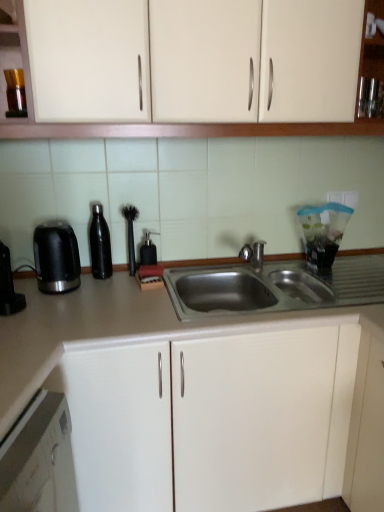
Question: From a real-world perspective, is black plastic kettle at left physically located above or below matte gray countertop at center?

Choices:
 (A) above
 (B) below

Answer: (A)

Question: In the image, is black plastic kettle at left on the left side or the right side of matte gray countertop at center?

Choices:
 (A) left
 (B) right

Answer: (A)

Question: Which object is positioned closest to the black plastic kettle at left?

Choices:
 (A) black rubber brush at center, arranged as the second appliance when viewed from the right
 (B) black plastic coffee machine at left
 (C) matte white cabinets at upper center
 (D) black matte water bottle at left, which is counted as the first appliance, starting from the left
 (E) clear plastic blender at right, the 3th appliance from the left

Answer: (B)

Question: Estimate the real-world distances between objects in this image. Which object is farther from the black plastic kettle at left?

Choices:
 (A) black rubber brush at center, arranged as the second appliance when viewed from the right
 (B) matte white cabinets at upper center
 (C) black plastic coffee machine at left
 (D) clear plastic blender at right, the 3th appliance from the left
 (E) matte gray countertop at center

Answer: (D)